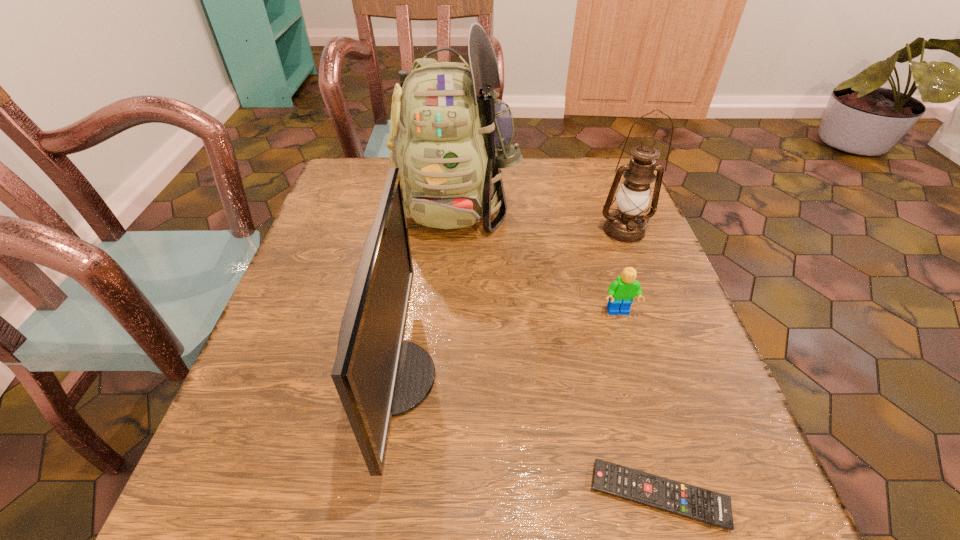
Where is `free spot that satisfies the following two spatial constraints: 1. on the front-facing side of the backpack; 2. on the right side of the oil lamp`? The height and width of the screenshot is (540, 960). free spot that satisfies the following two spatial constraints: 1. on the front-facing side of the backpack; 2. on the right side of the oil lamp is located at coordinates (453, 231).

At what (x,y) coordinates should I click in order to perform the action: click on free space that satisfies the following two spatial constraints: 1. on the front-facing side of the tallest object; 2. on the left side of the shortest object. Please return your answer as a coordinate pair (x, y). The image size is (960, 540). Looking at the image, I should click on (435, 495).

The image size is (960, 540). Find the location of `vacant area that satisfies the following two spatial constraints: 1. on the front-facing side of the oil lamp; 2. on the left side of the backpack`. vacant area that satisfies the following two spatial constraints: 1. on the front-facing side of the oil lamp; 2. on the left side of the backpack is located at coordinates (453, 231).